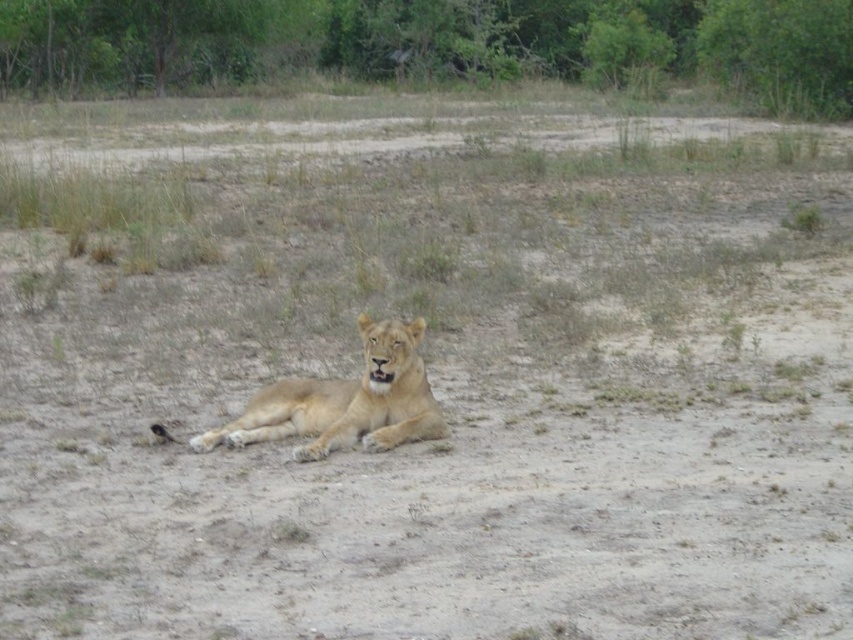
Question: Is green leafy tree at upper center to the right of golden fur lion at center from the viewer's perspective?

Choices:
 (A) yes
 (B) no

Answer: (B)

Question: Is green leafy tree at upper center to the left of golden fur lion at center from the viewer's perspective?

Choices:
 (A) no
 (B) yes

Answer: (B)

Question: Which of the following is the farthest from the observer?

Choices:
 (A) golden fur lion at center
 (B) green leafy tree at upper center

Answer: (B)

Question: Does green leafy tree at upper center appear on the left side of golden fur lion at center?

Choices:
 (A) yes
 (B) no

Answer: (A)

Question: Among these objects, which one is farthest from the camera?

Choices:
 (A) green leafy tree at upper center
 (B) golden fur lion at center

Answer: (A)